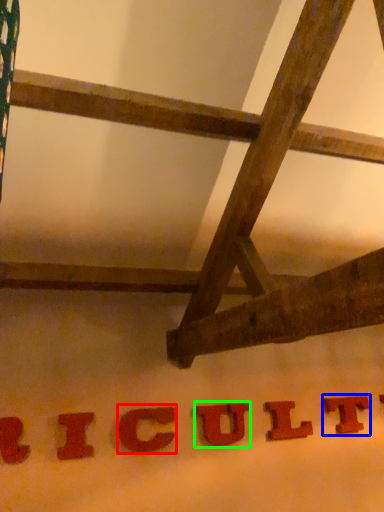
Question: Considering the real-world distances, which object is closest to letter (highlighted by a red box)? letter (highlighted by a blue box) or letter (highlighted by a green box).

Choices:
 (A) letter
 (B) letter

Answer: (B)